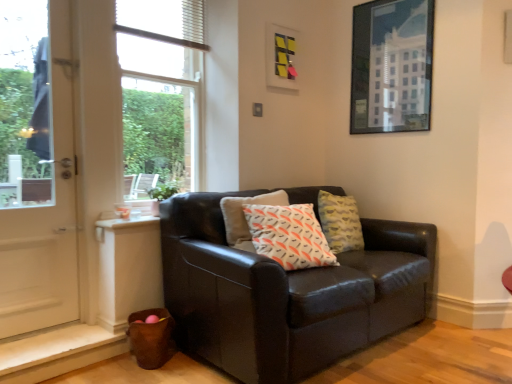
I want to click on white textured blind at upper center, so click(163, 21).

What do you see at coordinates (163, 21) in the screenshot? The image size is (512, 384). I see `white textured blind at upper center` at bounding box center [163, 21].

This screenshot has width=512, height=384. What do you see at coordinates (160, 90) in the screenshot?
I see `clear glass window at upper left` at bounding box center [160, 90].

What is the approximate width of metallic glass picture frame at upper right, the first picture frame in the right-to-left sequence?

1.70 inches.

This screenshot has width=512, height=384. Describe the element at coordinates (391, 66) in the screenshot. I see `metallic glass picture frame at upper right, the first picture frame in the right-to-left sequence` at that location.

You are a GUI agent. You are given a task and a screenshot of the screen. Output one action in this format:
    pyautogui.click(x=<x>, y=<y>)
    Task: Click on the white textured blind at upper center
    This screenshot has height=384, width=512.
    Given the screenshot: What is the action you would take?
    (x=163, y=21)

Can you confirm if white glossy door at left is bigger than clear glass window at upper left?

Yes, white glossy door at left is bigger than clear glass window at upper left.

Considering the relative positions of white glossy door at left and clear glass window at upper left in the image provided, is white glossy door at left to the right of clear glass window at upper left from the viewer's perspective?

No.

The height and width of the screenshot is (384, 512). Identify the location of door located in front of the clear glass window at upper left. (36, 168).

How many degrees apart are the facing directions of white glossy door at left and clear glass window at upper left?

There is a 1.21-degree angle between the facing directions of white glossy door at left and clear glass window at upper left.

Is clear glass window at upper left thinner than matte black couch at center?

Correct, the width of clear glass window at upper left is less than that of matte black couch at center.

Between clear glass window at upper left and matte black couch at center, which one appears on the left side from the viewer's perspective?

clear glass window at upper left is more to the left.

The height and width of the screenshot is (384, 512). In order to click on studio couch below the clear glass window at upper left (from a real-world perspective) in this screenshot , I will do `click(286, 293)`.

Which of these two, clear glass window at upper left or matte black couch at center, is bigger?

matte black couch at center is bigger.

How many degrees apart are the facing directions of yellow matte picture frame at upper center, the 1th picture frame from the left, and clear glass window at upper left?

The angular difference between yellow matte picture frame at upper center, the 1th picture frame from the left, and clear glass window at upper left is 1.32 degrees.

Is yellow matte picture frame at upper center, arranged as the 2th picture frame when viewed from the right, placed right next to clear glass window at upper left?

They are not placed beside each other.

Looking at their sizes, would you say yellow matte picture frame at upper center, arranged as the 2th picture frame when viewed from the right, is wider or thinner than clear glass window at upper left?

Result: yellow matte picture frame at upper center, arranged as the 2th picture frame when viewed from the right, is thinner than clear glass window at upper left.

Is yellow matte picture frame at upper center, arranged as the 2th picture frame when viewed from the right, aimed at clear glass window at upper left?

No, yellow matte picture frame at upper center, arranged as the 2th picture frame when viewed from the right, does not turn towards clear glass window at upper left.

How far apart are metallic glass picture frame at upper right, the first picture frame in the right-to-left sequence, and white textured blind at upper center?

metallic glass picture frame at upper right, the first picture frame in the right-to-left sequence, is 1.32 meters away from white textured blind at upper center.

From the image's perspective, does metallic glass picture frame at upper right, marked as the second picture frame in a left-to-right arrangement, appear lower than white textured blind at upper center?

Indeed, from the image's perspective, metallic glass picture frame at upper right, marked as the second picture frame in a left-to-right arrangement, is shown beneath white textured blind at upper center.

From a real-world perspective, is metallic glass picture frame at upper right, the first picture frame in the right-to-left sequence, under white textured blind at upper center?

Yes.

Who is smaller, metallic glass picture frame at upper right, the first picture frame in the right-to-left sequence, or white textured blind at upper center?

Smaller between the two is white textured blind at upper center.

Is white textured blind at upper center not close to yellow matte picture frame at upper center, the 1th picture frame from the left?

No, white textured blind at upper center is not far from yellow matte picture frame at upper center, the 1th picture frame from the left.

Which point is more distant from viewer, (200, 31) or (285, 54)?

The point (285, 54) is farther.

Between white textured blind at upper center and yellow matte picture frame at upper center, arranged as the 2th picture frame when viewed from the right, which one has smaller size?

yellow matte picture frame at upper center, arranged as the 2th picture frame when viewed from the right.

Is yellow matte picture frame at upper center, arranged as the 2th picture frame when viewed from the right, a part of white textured blind at upper center?

No, yellow matte picture frame at upper center, arranged as the 2th picture frame when viewed from the right, is not surrounded by white textured blind at upper center.

Considering the sizes of objects white glossy door at left and matte black couch at center in the image provided, who is thinner, white glossy door at left or matte black couch at center?

white glossy door at left.

Can matte black couch at center be found inside white glossy door at left?

No, matte black couch at center is located outside of white glossy door at left.

Considering the relative positions of white glossy door at left and matte black couch at center in the image provided, is white glossy door at left to the right of matte black couch at center from the viewer's perspective?

In fact, white glossy door at left is to the left of matte black couch at center.

How distant is yellow matte picture frame at upper center, the 1th picture frame from the left, from matte black couch at center?

4.85 feet.

From a real-world perspective, between yellow matte picture frame at upper center, arranged as the 2th picture frame when viewed from the right, and matte black couch at center, who is vertically higher?

yellow matte picture frame at upper center, arranged as the 2th picture frame when viewed from the right, from a real-world perspective.

Which object is positioned more to the right, yellow matte picture frame at upper center, the 1th picture frame from the left, or matte black couch at center?

Positioned to the right is matte black couch at center.

Is yellow matte picture frame at upper center, the 1th picture frame from the left, outside of matte black couch at center?

yellow matte picture frame at upper center, the 1th picture frame from the left, lies outside matte black couch at center's area.

Identify the location of window located above the white glossy door at left (from a real-world perspective). (160, 90).

Identify the location of window above the matte black couch at center (from the image's perspective). (160, 90).

Looking at the image, which one is located further to matte black couch at center, clear glass window at upper left or metallic glass picture frame at upper right, marked as the second picture frame in a left-to-right arrangement?

The object further to matte black couch at center is metallic glass picture frame at upper right, marked as the second picture frame in a left-to-right arrangement.

From the picture: From the image, which object appears to be nearer to clear glass window at upper left, yellow matte picture frame at upper center, arranged as the 2th picture frame when viewed from the right, or white glossy door at left?

yellow matte picture frame at upper center, arranged as the 2th picture frame when viewed from the right.

Estimate the real-world distances between objects in this image. Which object is further from yellow matte picture frame at upper center, arranged as the 2th picture frame when viewed from the right, white textured blind at upper center or white glossy door at left?

The object further to yellow matte picture frame at upper center, arranged as the 2th picture frame when viewed from the right, is white glossy door at left.

Which object lies nearer to the anchor point matte black couch at center, clear glass window at upper left or white textured blind at upper center?

Based on the image, clear glass window at upper left appears to be nearer to matte black couch at center.

From the picture: From the image, which object appears to be farther from clear glass window at upper left, white glossy door at left or metallic glass picture frame at upper right, the first picture frame in the right-to-left sequence?

Based on the image, metallic glass picture frame at upper right, the first picture frame in the right-to-left sequence, appears to be further to clear glass window at upper left.

Which object lies further to the anchor point white glossy door at left, clear glass window at upper left or yellow matte picture frame at upper center, the 1th picture frame from the left?

yellow matte picture frame at upper center, the 1th picture frame from the left, is positioned further to the anchor white glossy door at left.

Which object lies further to the anchor point yellow matte picture frame at upper center, arranged as the 2th picture frame when viewed from the right, metallic glass picture frame at upper right, the first picture frame in the right-to-left sequence, or white glossy door at left?

white glossy door at left is positioned further to the anchor yellow matte picture frame at upper center, arranged as the 2th picture frame when viewed from the right.

Looking at the image, which one is located closer to matte black couch at center, metallic glass picture frame at upper right, the first picture frame in the right-to-left sequence, or white glossy door at left?

metallic glass picture frame at upper right, the first picture frame in the right-to-left sequence, is closer to matte black couch at center.

I want to click on window located between white glossy door at left and matte black couch at center in the left-right direction, so click(x=160, y=90).

Where is `blind located between white glossy door at left and yellow matte picture frame at upper center, arranged as the 2th picture frame when viewed from the right, in the left-right direction`? The height and width of the screenshot is (384, 512). blind located between white glossy door at left and yellow matte picture frame at upper center, arranged as the 2th picture frame when viewed from the right, in the left-right direction is located at coordinates (163, 21).

Find the location of `window that lies between white textured blind at upper center and matte black couch at center from top to bottom`. window that lies between white textured blind at upper center and matte black couch at center from top to bottom is located at coordinates (160, 90).

The width and height of the screenshot is (512, 384). Identify the location of window between yellow matte picture frame at upper center, arranged as the 2th picture frame when viewed from the right, and matte black couch at center vertically. (160, 90).